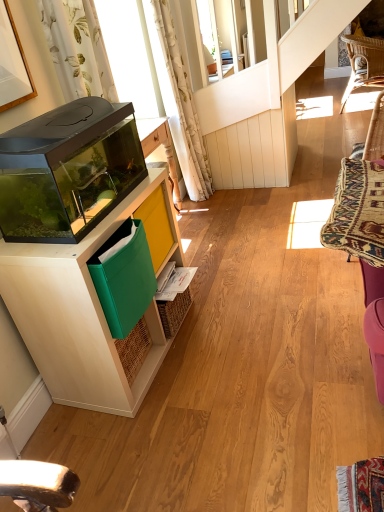
Question: From a real-world perspective, is white wood cabinet at left positioned over white floral fabric curtain at upper left, placed as the 2th curtain when sorted from right to left, based on gravity?

Choices:
 (A) yes
 (B) no

Answer: (B)

Question: From the image's perspective, is white wood cabinet at left beneath white floral fabric curtain at upper left, placed as the 2th curtain when sorted from right to left?

Choices:
 (A) no
 (B) yes

Answer: (B)

Question: From the image's perspective, is white wood cabinet at left on white floral fabric curtain at upper left, arranged as the 1th curtain when viewed from the left?

Choices:
 (A) yes
 (B) no

Answer: (B)

Question: Is white wood cabinet at left facing away from white floral fabric curtain at upper left, arranged as the 1th curtain when viewed from the left?

Choices:
 (A) yes
 (B) no

Answer: (B)

Question: Is white wood cabinet at left outside of white floral fabric curtain at upper left, which is the 1th curtain in front-to-back order?

Choices:
 (A) no
 (B) yes

Answer: (B)

Question: In terms of width, does woven wicker swivel chair at right look wider or thinner when compared to white floral fabric curtain at upper left, which is the 1th curtain in front-to-back order?

Choices:
 (A) thin
 (B) wide

Answer: (B)

Question: Considering the positions of point (370, 233) and point (46, 14), is point (370, 233) closer or farther from the camera than point (46, 14)?

Choices:
 (A) farther
 (B) closer

Answer: (B)

Question: Would you say woven wicker swivel chair at right is to the left or to the right of white floral fabric curtain at upper left, placed as the 2th curtain when sorted from right to left, in the picture?

Choices:
 (A) left
 (B) right

Answer: (B)

Question: From a real-world perspective, relative to white floral fabric curtain at upper left, placed as the 2th curtain when sorted from right to left, is woven wicker swivel chair at right vertically above or below?

Choices:
 (A) above
 (B) below

Answer: (B)

Question: From a real-world perspective, is white floral fabric curtain at upper center, the 1th curtain viewed from the back, above or below woven wicker swivel chair at right?

Choices:
 (A) above
 (B) below

Answer: (A)

Question: Looking at the image, does white floral fabric curtain at upper center, the 2th curtain in the front-to-back sequence, seem bigger or smaller compared to woven wicker swivel chair at right?

Choices:
 (A) big
 (B) small

Answer: (B)

Question: From their relative heights in the image, would you say white floral fabric curtain at upper center, the first curtain viewed from the right, is taller or shorter than woven wicker swivel chair at right?

Choices:
 (A) tall
 (B) short

Answer: (A)

Question: Does point (x=178, y=68) appear closer or farther from the camera than point (x=349, y=250)?

Choices:
 (A) farther
 (B) closer

Answer: (A)

Question: In the image, is green fabric folder at lower left positioned in front of or behind transparent glass aquarium at left?

Choices:
 (A) front
 (B) behind

Answer: (B)

Question: From a real-world perspective, is green fabric folder at lower left physically located above or below transparent glass aquarium at left?

Choices:
 (A) below
 (B) above

Answer: (A)